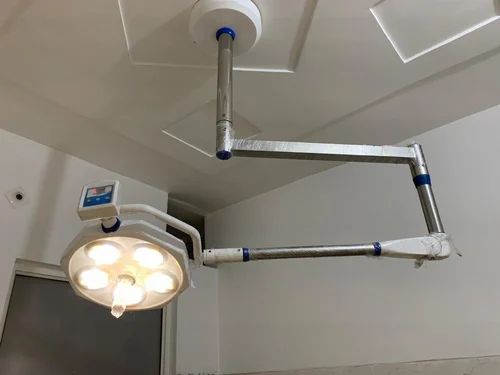
Locate an element on the screen. This screenshot has width=500, height=375. adjustable lighting fixture is located at coordinates (177, 250).